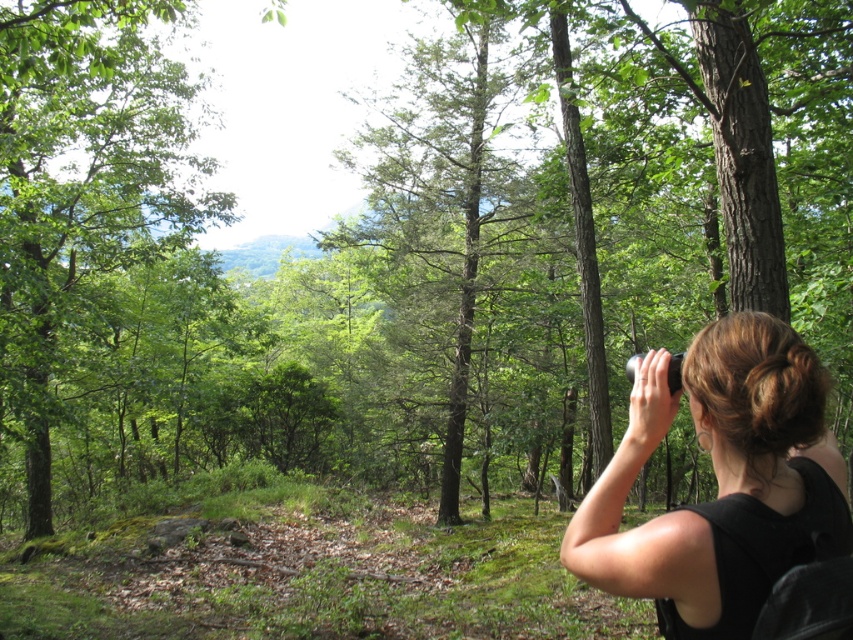
Measure the distance from green leafy tree at left to green matte tree at center.

They are 5.86 meters apart.

Between green leafy tree at left and green matte tree at center, which one has more height?

Standing taller between the two is green leafy tree at left.

This screenshot has height=640, width=853. Find the location of `green leafy tree at left`. green leafy tree at left is located at coordinates (82, 186).

Who is higher up, black matte binoculars at center or green matte tree at center?

green matte tree at center is above.

Where is `black matte binoculars at center`? This screenshot has height=640, width=853. black matte binoculars at center is located at coordinates (721, 481).

I want to click on black matte binoculars at center, so click(x=721, y=481).

Between green leafy tree at left and black matte binoculars at center, which one is positioned higher?

green leafy tree at left

Measure the distance between green leafy tree at left and black matte binoculars at center.

They are 17.54 meters apart.

This screenshot has width=853, height=640. What do you see at coordinates (82, 186) in the screenshot? I see `green leafy tree at left` at bounding box center [82, 186].

This screenshot has height=640, width=853. Identify the location of green leafy tree at left. (82, 186).